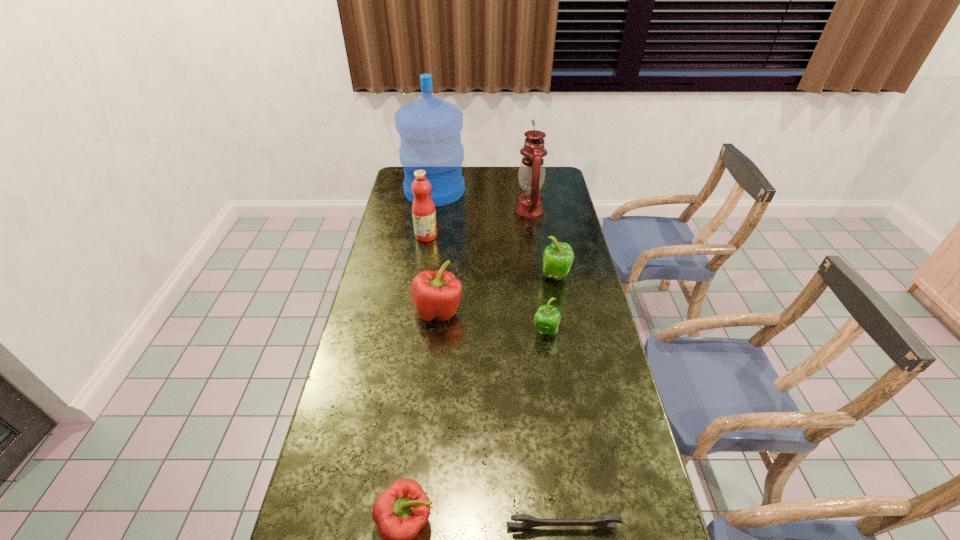
Where is `water jug`? The width and height of the screenshot is (960, 540). water jug is located at coordinates (430, 128).

This screenshot has height=540, width=960. In order to click on the tallest object in this screenshot , I will do `click(430, 128)`.

Image resolution: width=960 pixels, height=540 pixels. In order to click on oil lamp in this screenshot , I will do `click(531, 175)`.

The height and width of the screenshot is (540, 960). Identify the location of the second tallest object. (531, 175).

The image size is (960, 540). I want to click on fruit juice, so click(x=423, y=209).

Find the location of `pink fruit juice`. pink fruit juice is located at coordinates (423, 209).

The image size is (960, 540). In order to click on the bigger green bell pepper in this screenshot , I will do `click(558, 257)`.

This screenshot has height=540, width=960. What are the coordinates of `the farthest bell pepper` in the screenshot? It's located at (558, 257).

Identify the location of the bigger pink bell pepper. This screenshot has width=960, height=540. (435, 295).

You are a GUI agent. You are given a task and a screenshot of the screen. Output one action in this format:
    pyautogui.click(x=<x>, y=<y>)
    Task: Click on the smaller green bell pepper
    This screenshot has height=540, width=960.
    Given the screenshot: What is the action you would take?
    pyautogui.click(x=547, y=318)